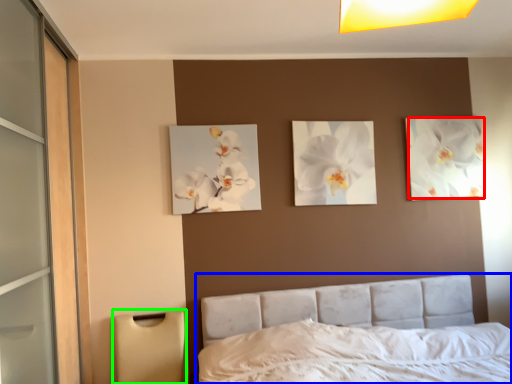
Question: Estimate the real-world distances between objects in this image. Which object is closer to flower (highlighted by a red box), bed (highlighted by a blue box) or lamp (highlighted by a green box)?

Choices:
 (A) bed
 (B) lamp

Answer: (A)